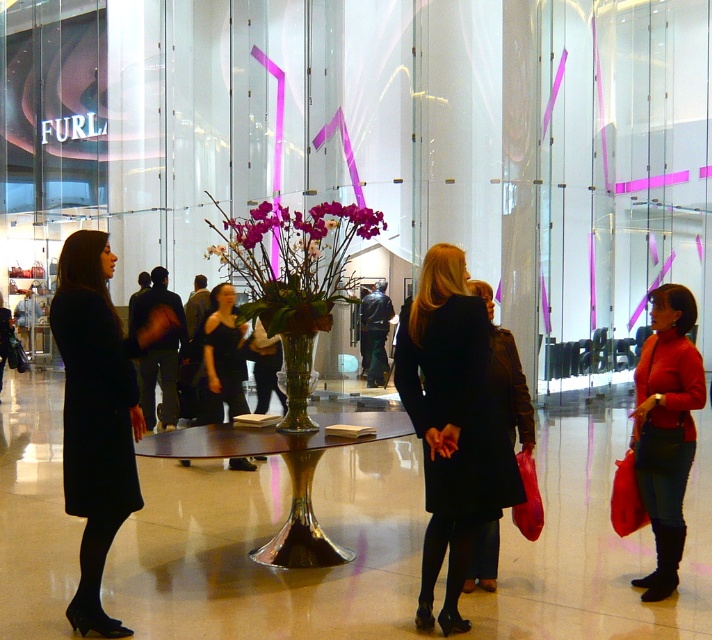
You are a customer in the mall and you want to place your matte black coat at left on the metallic gold table at center. Is there enough vertical space between them for you to do so?

The matte black coat at left is already above the metallic gold table at center, so there is sufficient vertical space to place it on the table.

You are a customer in the mall and want to place a small gift on the closest object to you. Which object should you choose between the matte black coat at left and the metallic gold table at center?

The matte black coat at left is closer to the viewer than the metallic gold table at center, so you should place the gift on the matte black coat at left.